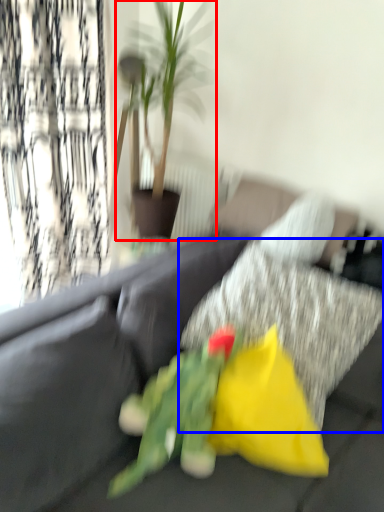
Question: Among these objects, which one is farthest to the camera, houseplant (highlighted by a red box) or pillow (highlighted by a blue box)?

Choices:
 (A) houseplant
 (B) pillow

Answer: (A)